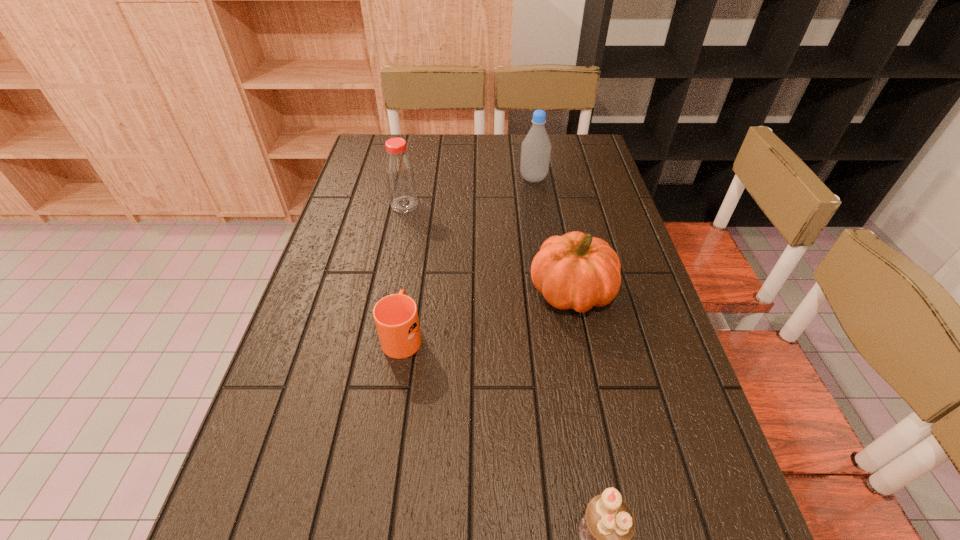
The image size is (960, 540). What are the coordinates of `vacant space located on the handle side of the shortest object` in the screenshot? It's located at (420, 228).

Locate an element on the screen. vacant space located on the handle side of the shortest object is located at coordinates (420, 221).

You are a GUI agent. You are given a task and a screenshot of the screen. Output one action in this format:
    pyautogui.click(x=<x>, y=<y>)
    Task: Click on the object present at the left edge
    The height and width of the screenshot is (540, 960).
    Given the screenshot: What is the action you would take?
    pyautogui.click(x=400, y=177)

In order to click on object at the right edge in this screenshot , I will do pos(576,271).

Where is `vacant space at the far edge`? This screenshot has width=960, height=540. vacant space at the far edge is located at coordinates (553, 167).

This screenshot has height=540, width=960. I want to click on vacant space at the left edge of the desktop, so click(360, 228).

Where is `free point at the right edge`? free point at the right edge is located at coordinates (628, 467).

Identify the location of vacant area that lies between the mug and the right bottle. The width and height of the screenshot is (960, 540). (468, 256).

Where is `free space between the pumpkin and the mug`? This screenshot has height=540, width=960. free space between the pumpkin and the mug is located at coordinates (487, 314).

You are a GUI agent. You are given a task and a screenshot of the screen. Output one action in this format:
    pyautogui.click(x=<x>, y=<y>)
    Task: Click on the free space between the nearer bottle and the pumpkin
    
    Given the screenshot: What is the action you would take?
    pyautogui.click(x=488, y=248)